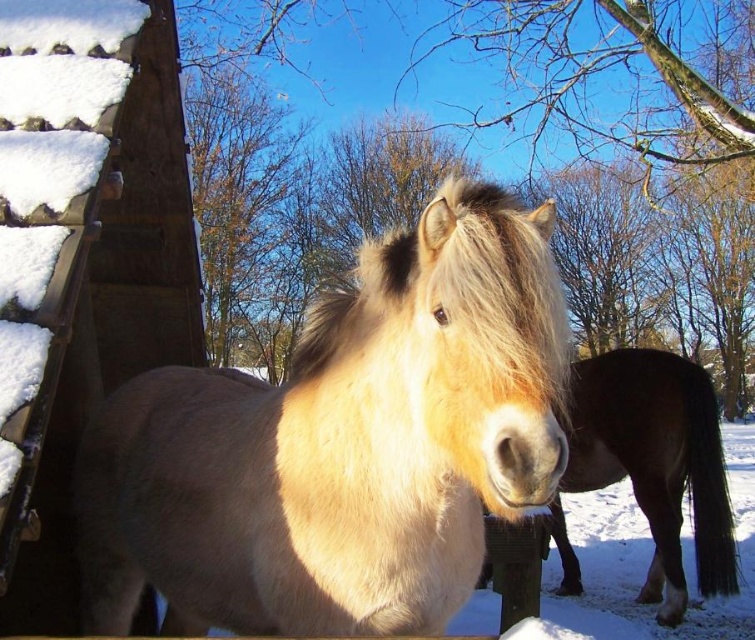
Between light brown fur horse at center and brown fuzzy horse at center, which one appears on the right side from the viewer's perspective?

From the viewer's perspective, brown fuzzy horse at center appears more on the right side.

Does light brown fur horse at center have a greater width compared to brown fuzzy horse at center?

Yes.

Does point (501, 292) come farther from viewer compared to point (578, 380)?

No, (501, 292) is closer to viewer.

Where is `light brown fur horse at center`? This screenshot has height=640, width=755. light brown fur horse at center is located at coordinates (341, 444).